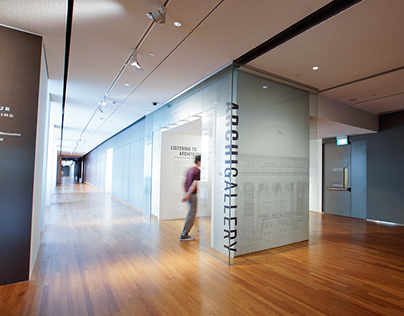
I want to click on door, so click(x=340, y=160).